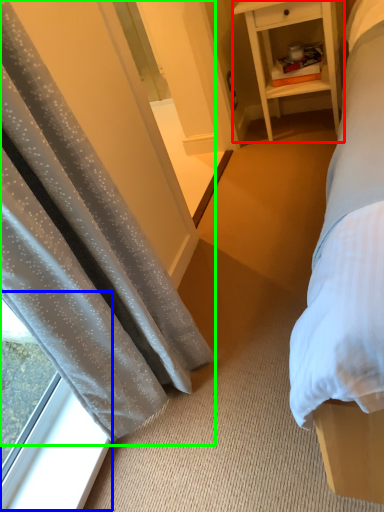
Question: Which object is the farthest from nightstand (highlighted by a red box)? Choose among these: window (highlighted by a blue box) or curtain (highlighted by a green box).

Choices:
 (A) window
 (B) curtain

Answer: (A)